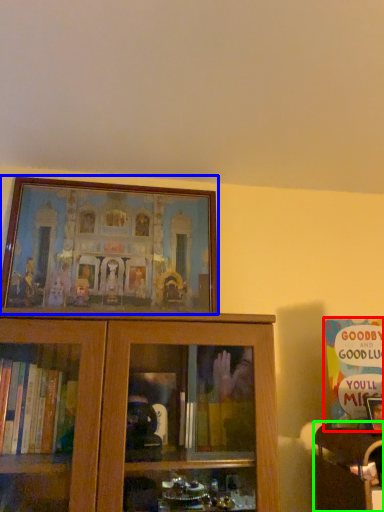
Question: Based on their relative distances, which object is farther from book (highlighted by a red box)? Choose from picture frame (highlighted by a blue box) and furniture (highlighted by a green box).

Choices:
 (A) picture frame
 (B) furniture

Answer: (A)